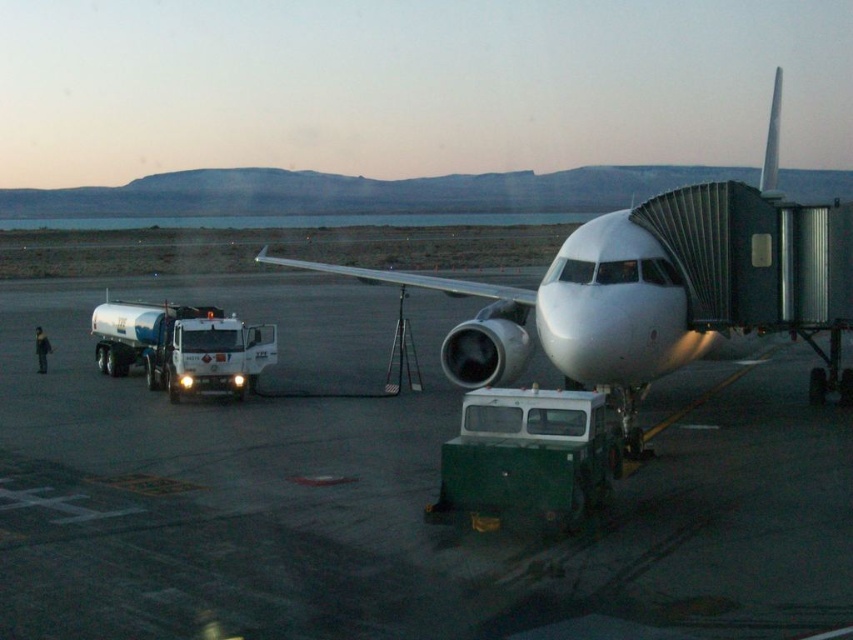
Question: Which point appears farthest from the camera in this image?

Choices:
 (A) (250, 364)
 (B) (448, 476)

Answer: (A)

Question: Which point is closer to the camera?

Choices:
 (A) white glossy airplane at center
 (B) green matte truck at lower center
 (C) smooth asphalt tarmac at center

Answer: (C)

Question: From the image, what is the correct spatial relationship of smooth asphalt tarmac at center in relation to white glossy airplane at center?

Choices:
 (A) above
 (B) below

Answer: (B)

Question: Can you confirm if white glossy airplane at center is bigger than green matte truck at lower center?

Choices:
 (A) yes
 (B) no

Answer: (A)

Question: Is smooth asphalt tarmac at center to the left of white glossy fuel truck at left from the viewer's perspective?

Choices:
 (A) yes
 (B) no

Answer: (B)

Question: Among these objects, which one is farthest from the camera?

Choices:
 (A) white glossy fuel truck at left
 (B) white glossy airplane at center

Answer: (A)